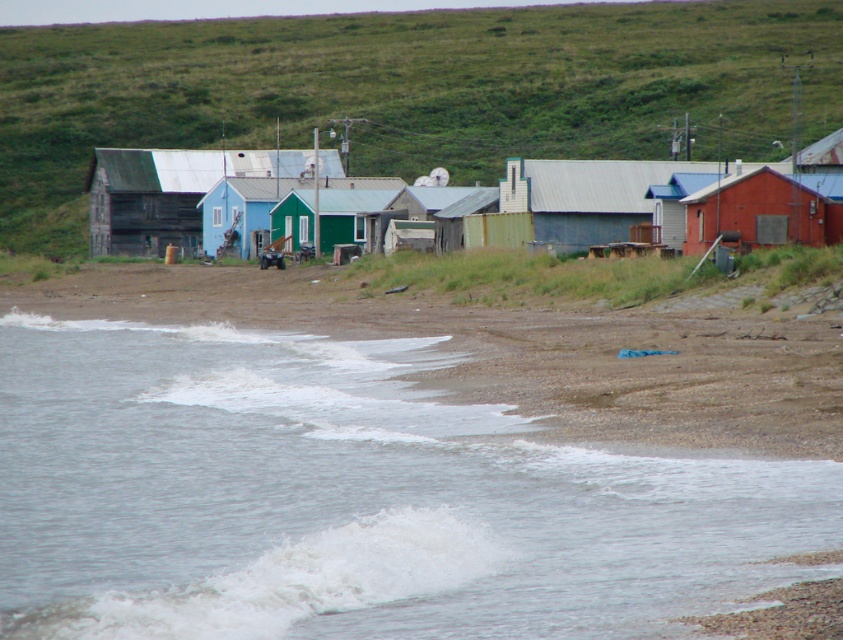
You are a hiker who has just arrived at the beach and wants to reach the wooden cabin at center. You see the green grassy hillside at upper center. Which direction should you walk to avoid the hillside and reach the cabin?

You should walk to the left side of the green grassy hillside at upper center to reach the wooden cabin at center since the hillside is on the right side of the cabin.

You are a hiker who has just arrived at the coastal area and wants to find the highest point to get a better view of the surroundings. You notice the green grassy hillside at upper center and the wooden cabin at center. Which one should you climb to get the higher vantage point?

The green grassy hillside at upper center has a greater height compared to the wooden cabin at center, so you should climb the green grassy hillside at upper center to get the higher vantage point.

You are standing at the point marked by the coordinates point (406, 92) in the coastal scene. Looking around, you see the blue house, green house, red house, and other small buildings. Which direction should you walk to reach the green grassy hillside at upper center?

The point (406, 92) is located at the green grassy hillside at upper center, so you are already there.